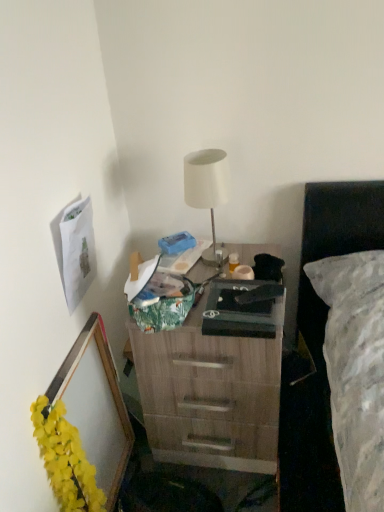
What is the approximate height of wooden picture frame at lower left?

It is 63.69 centimeters.

Measure the distance between wooden picture frame at lower left and camera.

wooden picture frame at lower left is 3.54 feet away from camera.

The width and height of the screenshot is (384, 512). What do you see at coordinates (65, 459) in the screenshot? I see `yellow fabric garland at lower left` at bounding box center [65, 459].

The image size is (384, 512). What do you see at coordinates (214, 382) in the screenshot?
I see `wooden desk at center` at bounding box center [214, 382].

Identify the location of white matte lamp at center. (207, 190).

Where is `wooden picture frame at lower left`? The image size is (384, 512). wooden picture frame at lower left is located at coordinates (96, 405).

Considering the relative sizes of wooden desk at center and matte black box at center in the image provided, is wooden desk at center smaller than matte black box at center?

Answer: No.

Does point (253, 341) come closer to viewer compared to point (221, 281)?

Yes.

Does wooden desk at center touch matte black box at center?

No, wooden desk at center is not beside matte black box at center.

Does wooden picture frame at lower left have a greater width compared to matte black box at center?

Incorrect, the width of wooden picture frame at lower left does not surpass that of matte black box at center.

Which is nearer, (80,350) or (211,298)?

Point (211,298)

Who is shorter, yellow fabric garland at lower left or wooden picture frame at lower left?

yellow fabric garland at lower left is shorter.

Is yellow fabric garland at lower left not close to wooden picture frame at lower left?

yellow fabric garland at lower left is actually quite close to wooden picture frame at lower left.

Considering the points (57, 477) and (89, 404), which point is in front, point (57, 477) or point (89, 404)?

The point (57, 477) is closer to the camera.

Is yellow fabric garland at lower left at the right side of wooden picture frame at lower left?

No, yellow fabric garland at lower left is not to the right of wooden picture frame at lower left.

In the scene shown: Is wooden picture frame at lower left positioned beyond the bounds of yellow fabric garland at lower left?

Absolutely, wooden picture frame at lower left is external to yellow fabric garland at lower left.

Considering the relative positions of wooden picture frame at lower left and yellow fabric garland at lower left in the image provided, is wooden picture frame at lower left to the left of yellow fabric garland at lower left from the viewer's perspective?

In fact, wooden picture frame at lower left is to the right of yellow fabric garland at lower left.

Image resolution: width=384 pixels, height=512 pixels. Identify the location of picture frame on the right side of yellow fabric garland at lower left. (96, 405).

Is matte black box at center at the left side of wooden desk at center?

No, matte black box at center is not to the left of wooden desk at center.

Considering the relative positions of matte black box at center and wooden desk at center in the image provided, is matte black box at center behind wooden desk at center?

No, it is in front of wooden desk at center.

Where is `picture frame lying below the wooden desk at center (from the image's perspective)`? This screenshot has width=384, height=512. picture frame lying below the wooden desk at center (from the image's perspective) is located at coordinates (96, 405).

From the image's perspective, is wooden desk at center above or below wooden picture frame at lower left?

Based on their image positions, wooden desk at center is located above wooden picture frame at lower left.

From a real-world perspective, is wooden desk at center positioned under wooden picture frame at lower left based on gravity?

No.

Is wooden desk at center in contact with yellow fabric garland at lower left?

No, wooden desk at center is not in contact with yellow fabric garland at lower left.

How many degrees apart are the facing directions of wooden desk at center and yellow fabric garland at lower left?

90 degrees.

Is wooden desk at center further to camera compared to yellow fabric garland at lower left?

Yes.

This screenshot has height=512, width=384. I want to click on flower on the left side of wooden desk at center, so click(x=65, y=459).

Locate an element on the screen. This screenshot has height=512, width=384. box above the wooden desk at center (from the image's perspective) is located at coordinates (242, 310).

The height and width of the screenshot is (512, 384). Identify the location of box behind the wooden picture frame at lower left. (242, 310).

From the image, which object appears to be nearer to matte black box at center, wooden desk at center or yellow fabric garland at lower left?

Based on the image, wooden desk at center appears to be nearer to matte black box at center.

From the image, which object appears to be nearer to white matte lamp at center, yellow fabric garland at lower left or matte black box at center?

matte black box at center is positioned closer to the anchor white matte lamp at center.

Estimate the real-world distances between objects in this image. Which object is further from matte black box at center, yellow fabric garland at lower left or wooden picture frame at lower left?

yellow fabric garland at lower left.

From the image, which object appears to be farther from wooden picture frame at lower left, wooden desk at center or white matte lamp at center?

white matte lamp at center is further to wooden picture frame at lower left.

Based on their spatial positions, is matte black box at center or wooden picture frame at lower left further from wooden desk at center?

wooden picture frame at lower left is further to wooden desk at center.

From the image, which object appears to be nearer to white matte lamp at center, wooden picture frame at lower left or matte black box at center?

Based on the image, matte black box at center appears to be nearer to white matte lamp at center.

Based on their spatial positions, is matte black box at center or yellow fabric garland at lower left further from white matte lamp at center?

yellow fabric garland at lower left is positioned further to the anchor white matte lamp at center.

Based on their spatial positions, is wooden picture frame at lower left or white matte lamp at center further from matte black box at center?

Based on the image, wooden picture frame at lower left appears to be further to matte black box at center.

Locate an element on the screen. The height and width of the screenshot is (512, 384). desk between white matte lamp at center and wooden picture frame at lower left in the up-down direction is located at coordinates 214,382.

Where is `picture frame between white matte lamp at center and yellow fabric garland at lower left in the up-down direction`? picture frame between white matte lamp at center and yellow fabric garland at lower left in the up-down direction is located at coordinates (96, 405).

What are the coordinates of `box that lies between white matte lamp at center and wooden desk at center from top to bottom` in the screenshot? It's located at (242, 310).

Where is `desk between wooden picture frame at lower left and matte black box at center in the horizontal direction`? desk between wooden picture frame at lower left and matte black box at center in the horizontal direction is located at coordinates (214, 382).